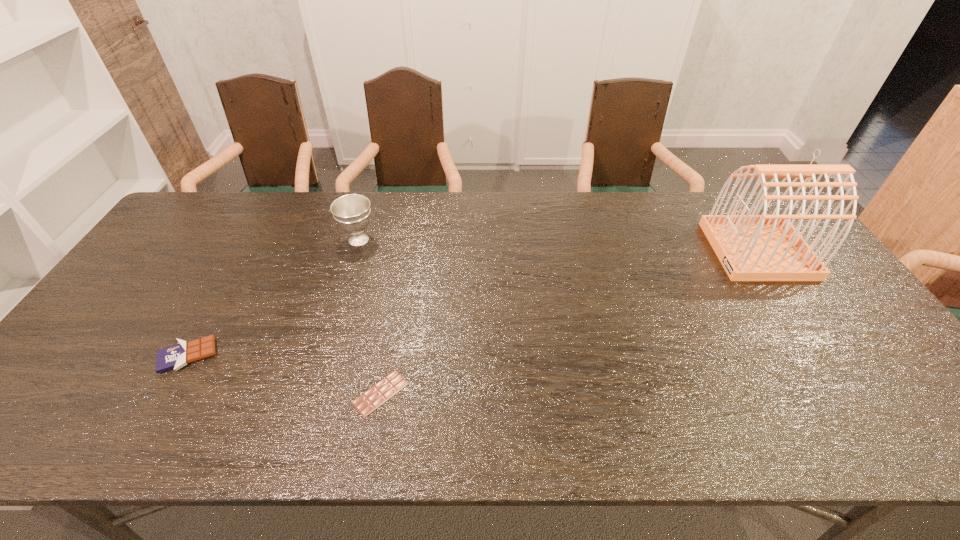
The height and width of the screenshot is (540, 960). What are the coordinates of `free region at the near edge of the desktop` in the screenshot? It's located at (392, 421).

The width and height of the screenshot is (960, 540). In order to click on vacant region at the left edge of the desktop in this screenshot , I will do `click(142, 298)`.

Where is `free space at the right edge of the desktop`? Image resolution: width=960 pixels, height=540 pixels. free space at the right edge of the desktop is located at coordinates (856, 324).

Locate an element on the screen. This screenshot has width=960, height=540. vacant region between the shorter chocolate bar and the third tallest object is located at coordinates (284, 374).

At what (x,y) coordinates should I click in order to perform the action: click on free space between the third shortest object and the birdcage. Please return your answer as a coordinate pair (x, y). The height and width of the screenshot is (540, 960). Looking at the image, I should click on (558, 245).

In order to click on vacant space that is in between the chalice and the third object from left to right in this screenshot , I will do `click(370, 316)`.

This screenshot has height=540, width=960. I want to click on free spot between the shortest object and the rightmost object, so click(569, 322).

The image size is (960, 540). I want to click on vacant point located between the taller chocolate bar and the second object from left to right, so click(x=274, y=298).

Locate an element on the screen. empty space that is in between the second object from left to right and the rightmost object is located at coordinates (558, 245).

This screenshot has height=540, width=960. Find the location of `free space between the shorter chocolate bar and the third shortest object`. free space between the shorter chocolate bar and the third shortest object is located at coordinates (370, 316).